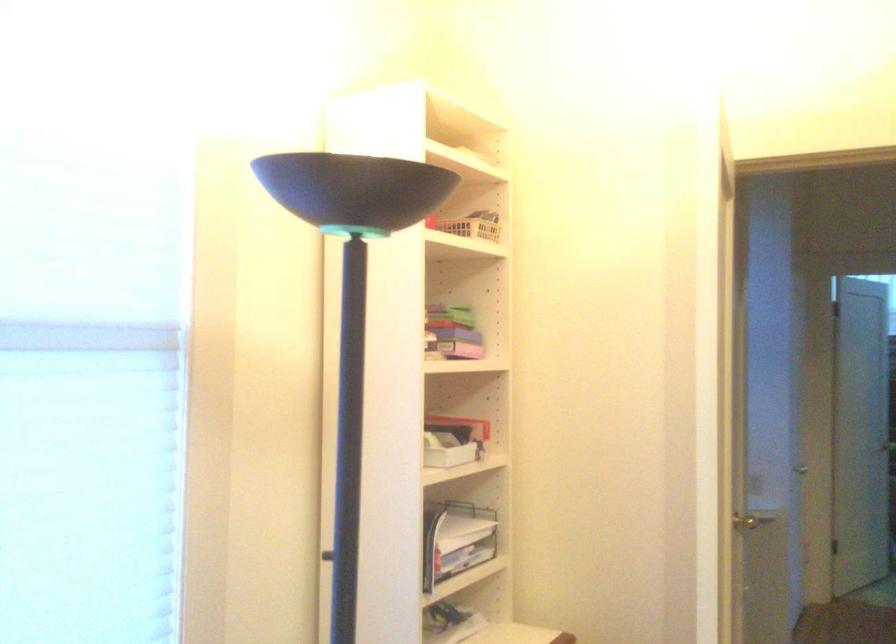
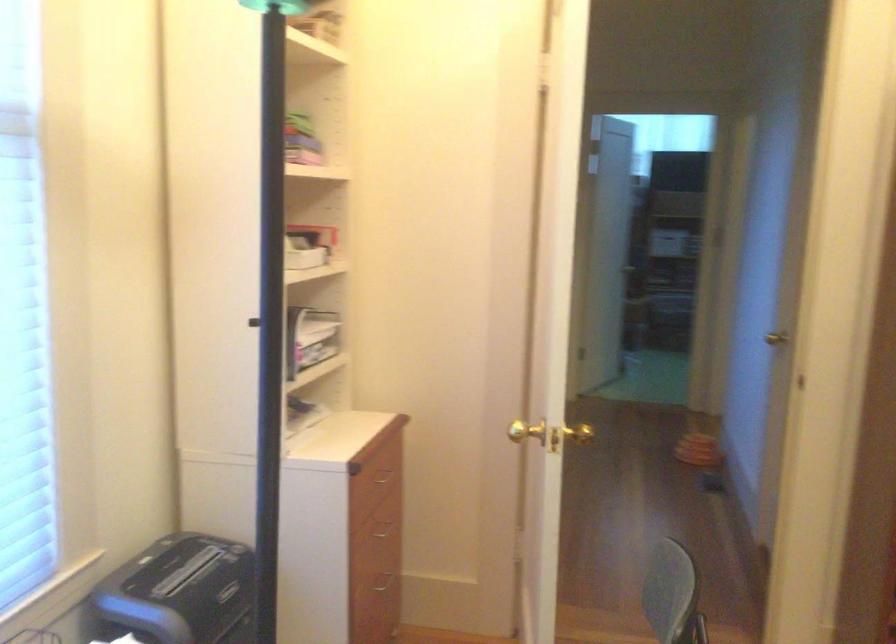
The images are taken continuously from a first-person perspective. In which direction are you moving?

The cameraman walked toward left, backward.